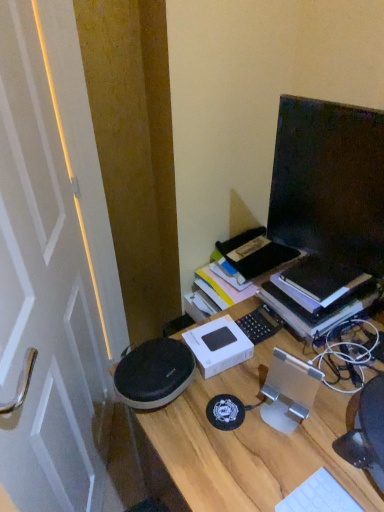
Question: Is wooden desk at center closer to the viewer compared to hardcover book at right?

Choices:
 (A) no
 (B) yes

Answer: (B)

Question: From the image's perspective, would you say wooden desk at center is shown under hardcover book at right?

Choices:
 (A) yes
 (B) no

Answer: (A)

Question: Is hardcover book at right inside wooden desk at center?

Choices:
 (A) yes
 (B) no

Answer: (B)

Question: Considering the relative positions of wooden desk at center and hardcover book at right in the image provided, is wooden desk at center to the right of hardcover book at right from the viewer's perspective?

Choices:
 (A) yes
 (B) no

Answer: (B)

Question: Is wooden desk at center to the left of hardcover book at right from the viewer's perspective?

Choices:
 (A) yes
 (B) no

Answer: (A)

Question: Is wooden desk at center positioned with its back to hardcover book at right?

Choices:
 (A) no
 (B) yes

Answer: (A)

Question: Could you tell me if white plastic keyboard at lower right is turned towards wooden desk at center?

Choices:
 (A) no
 (B) yes

Answer: (A)

Question: From a real-world perspective, is white plastic keyboard at lower right under wooden desk at center?

Choices:
 (A) no
 (B) yes

Answer: (A)

Question: Would you say white plastic keyboard at lower right contains wooden desk at center?

Choices:
 (A) yes
 (B) no

Answer: (B)

Question: Is white plastic keyboard at lower right next to wooden desk at center and touching it?

Choices:
 (A) yes
 (B) no

Answer: (B)

Question: From a real-world perspective, is white plastic keyboard at lower right over wooden desk at center?

Choices:
 (A) no
 (B) yes

Answer: (B)

Question: Considering the relative sizes of white plastic keyboard at lower right and wooden desk at center in the image provided, is white plastic keyboard at lower right bigger than wooden desk at center?

Choices:
 (A) yes
 (B) no

Answer: (B)

Question: Is the position of hardcover book at right less distant than that of black glossy monitor at upper right?

Choices:
 (A) yes
 (B) no

Answer: (B)